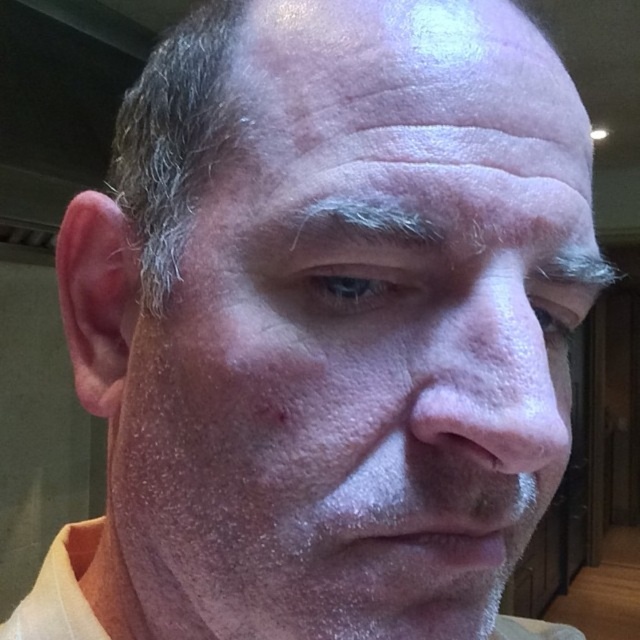
You are a photographer adjusting your camera settings to capture the person in the scene. Considering the smooth skin nose at center and the yellow cotton shirt at lower center, which object should you focus on if you want to ensure the smaller one is in sharp focus?

The smooth skin nose at center is smaller than the yellow cotton shirt at lower center, so you should focus on the smooth skin nose at center to ensure it is in sharp focus.

Based on the scene description, can you determine the spatial relationship between the smooth skin at upper center and the yellow cotton shirt at lower center?

The smooth skin at upper center is to the right of the yellow cotton shirt at lower center.

You are a photographer using a camera with a focal length of 50mm. You want to take a portrait of the person in the image while maintaining a sharp focus on the smooth skin at upper center. What is the minimum distance you should keep between the camera and the subject to achieve this?

The smooth skin at upper center and camera are 10.22 inches apart. To maintain sharp focus, the photographer should ensure the camera is positioned at least 10.22 inches away from the subject.